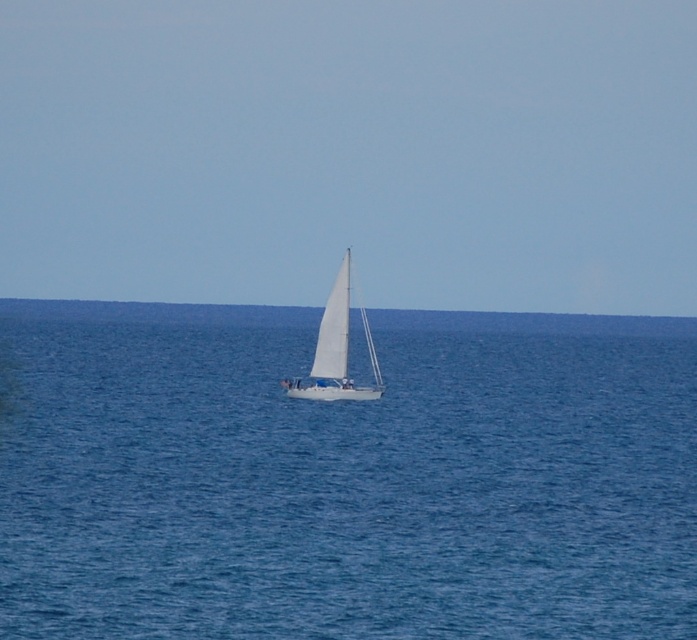
Question: In this image, where is blue water at center located relative to white matte sailboat at center?

Choices:
 (A) right
 (B) left

Answer: (A)

Question: Does blue water at center appear under white matte sailboat at center?

Choices:
 (A) yes
 (B) no

Answer: (A)

Question: Among these objects, which one is farthest from the camera?

Choices:
 (A) blue water at center
 (B) white matte sailboat at center

Answer: (B)

Question: Which point appears closest to the camera in this image?

Choices:
 (A) [374, 385]
 (B) [579, 500]

Answer: (B)

Question: Is blue water at center bigger than white matte sailboat at center?

Choices:
 (A) no
 (B) yes

Answer: (B)